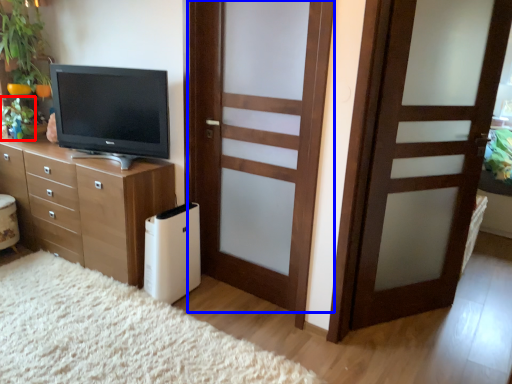
Question: Which object appears farthest to the camera in this image, plant (highlighted by a red box) or door (highlighted by a blue box)?

Choices:
 (A) plant
 (B) door

Answer: (A)